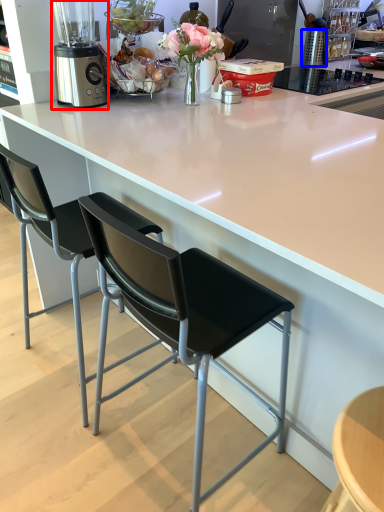
Question: Which object appears farthest to the camera in this image, blender (highlighted by a red box) or kitchen appliance (highlighted by a blue box)?

Choices:
 (A) blender
 (B) kitchen appliance

Answer: (B)